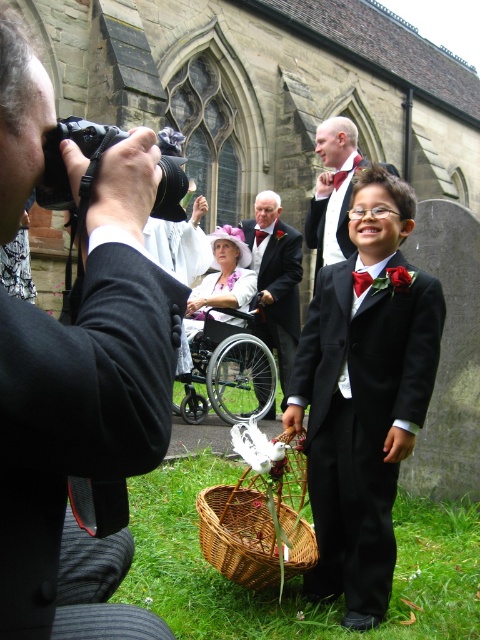
Question: Which object is farther from the camera taking this photo?

Choices:
 (A) red satin bow tie at center
 (B) white satin flower girl at center

Answer: (A)

Question: From the image, what is the correct spatial relationship of black plastic wheelchair at center in relation to red satin bow tie at center?

Choices:
 (A) below
 (B) above

Answer: (A)

Question: Can you confirm if matte black suit at center is positioned to the right of shiny black suit at center?

Choices:
 (A) yes
 (B) no

Answer: (B)

Question: Which object is closer to the camera taking this photo?

Choices:
 (A) shiny black suit at center
 (B) red satin bow tie at center

Answer: (A)

Question: Is woven brown basket at lower center thinner than white satin flower girl at center?

Choices:
 (A) no
 (B) yes

Answer: (A)

Question: Which of the following is the farthest from the observer?

Choices:
 (A) shiny black suit at center
 (B) matte black suit at center
 (C) red satin bow tie at center

Answer: (C)